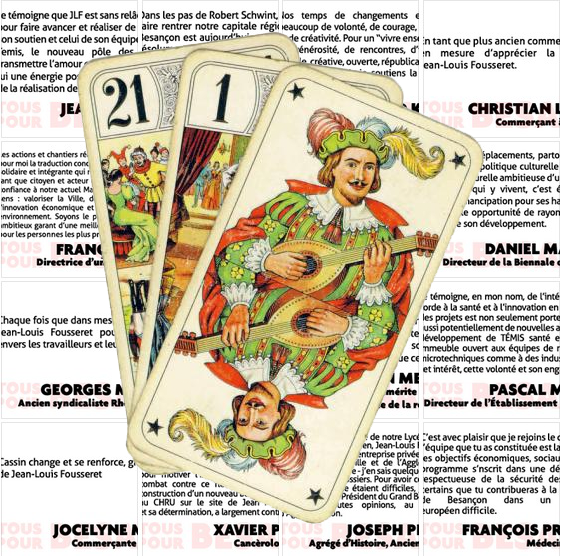
At what (x,y) coordinates should I click in order to perform the action: click on curtain. Please return your answer as a coordinate pair (x, y). The image size is (561, 556). Looking at the image, I should click on (201, 146).